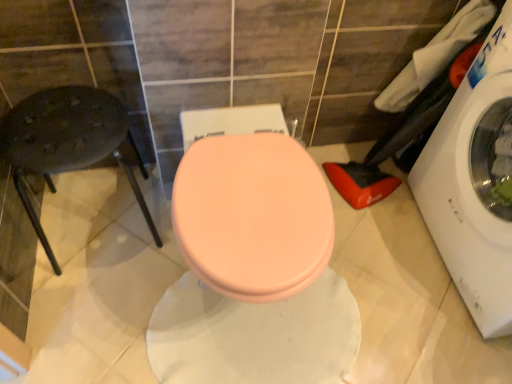
This screenshot has height=384, width=512. In order to click on vacant space to the left of matte pink toilet seat at center in this screenshot , I will do `click(106, 281)`.